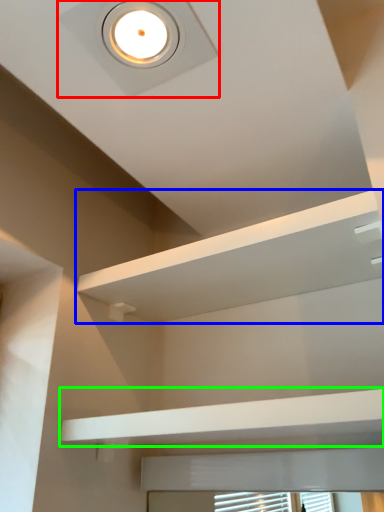
Question: Which object is the closest to the droplight (highlighted by a red box)? Choose among these: shelf (highlighted by a blue box) or balustrade (highlighted by a green box).

Choices:
 (A) shelf
 (B) balustrade

Answer: (A)